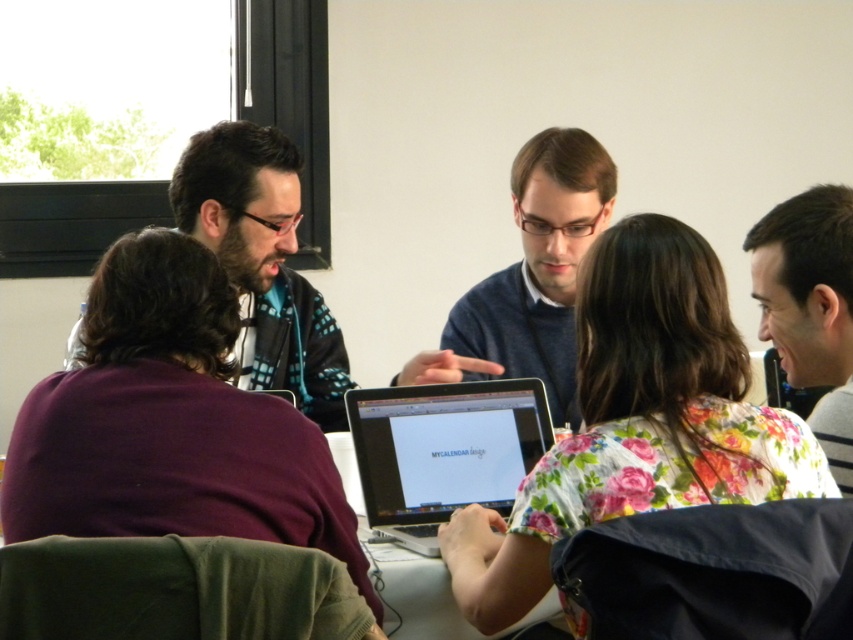
You are standing in front of the table where the meeting is happening. You notice two points marked on the table surface. The first point is at coordinate point (309, 381) and the second is at point (550, 404). Which point is closer to you?

Point (309, 381) is closer to you because it is further to the viewer than point (550, 404).

You are observing a meeting scene where a person with dark brown hair at upper right is present. Based on their position at coordinates point 0.481, 0.951, can you determine if they are seated to the left or right side of the table?

The dark brown hair at upper right is located at point (810, 307), which indicates they are positioned at the upper right area of the scene. Since the table is rectangular and the group is seated around it, their position likely places them on the right side of the table from the observer perspective.